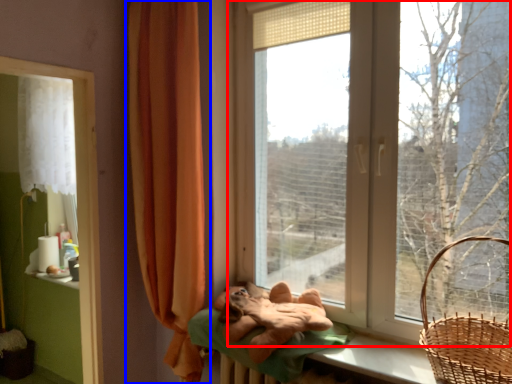
Question: Which of the following is the closest to the observer, window (highlighted by a red box) or curtain (highlighted by a blue box)?

Choices:
 (A) window
 (B) curtain

Answer: (A)